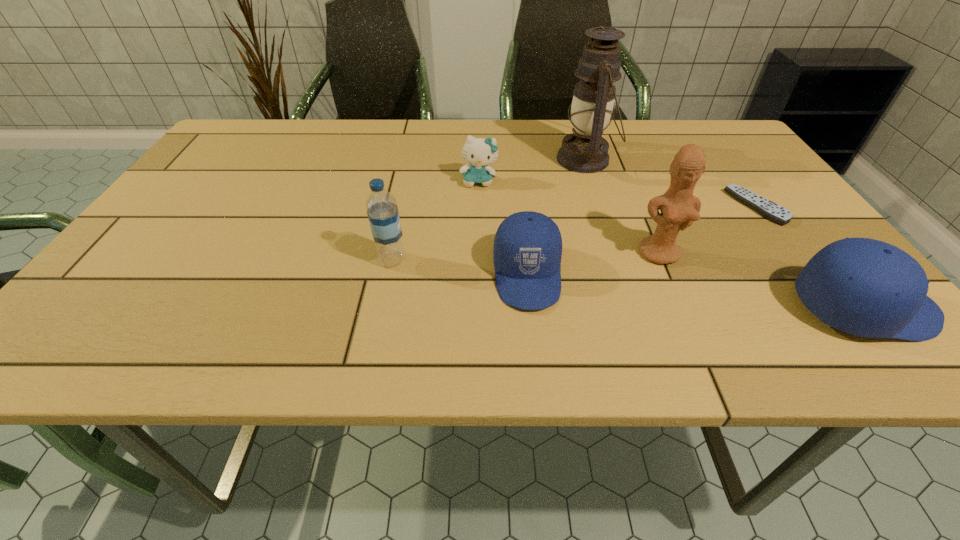
Where is `vacant point that satisfies the following two spatial constraints: 1. on the face of the kitten; 2. on the left side of the shortest object`? The height and width of the screenshot is (540, 960). vacant point that satisfies the following two spatial constraints: 1. on the face of the kitten; 2. on the left side of the shortest object is located at coordinates (479, 207).